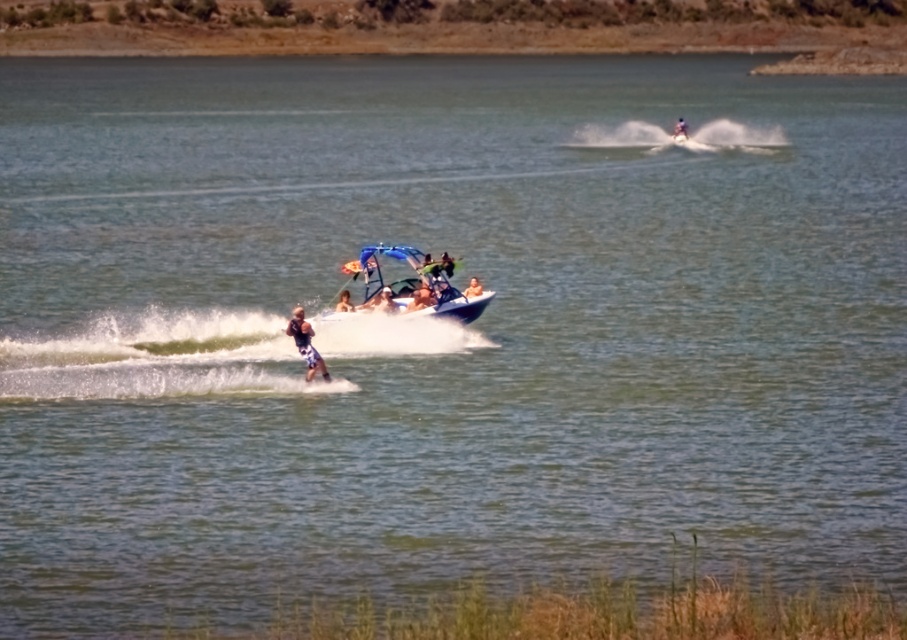
You are a photographer trying to capture a photo of both the blue glossy boat at center and the matte blue shorts at center in the same frame. Given that your camera has a minimum focus distance of 30 inches, will you be able to focus on both objects simultaneously?

The blue glossy boat at center and the matte blue shorts at center are 33.40 inches apart. Since the distance between them is greater than the camera minimum focus distance of 30 inches, the camera can focus on both objects simultaneously.

You are standing on the dock and looking at two points in the lake. The first point is at coordinates point (354, 292) and the second point is at coordinates point (346, 305). Which point is closer to you?

Point (354, 292) is further to the camera than point (346, 305), so the second point is closer to you.

You are a lifeguard observing the water skiing activity. You notice two blue items at the center of the scene. Which item is wider? The smooth blue board at center or the matte blue shorts at center?

The smooth blue board at center is wider than the matte blue shorts at center according to the description.